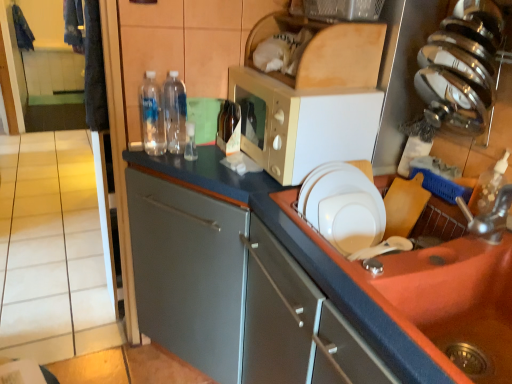
Question: In terms of height, does white glossy plate at upper right look taller or shorter compared to transparent plastic bottle at center, the 2th bottle when ordered from left to right?

Choices:
 (A) tall
 (B) short

Answer: (B)

Question: Based on their sizes in the image, would you say white glossy plate at upper right is bigger or smaller than transparent plastic bottle at center, the 2th bottle viewed from the right?

Choices:
 (A) big
 (B) small

Answer: (B)

Question: Based on their relative distances, which object is farther from the brown glass bottle at center, which is the 1th bottle in right-to-left order?

Choices:
 (A) orange matte sink at lower right
 (B) white glossy plate at upper right
 (C) matte gray cabinet at center
 (D) transparent plastic bottle at center, the 2th bottle when ordered from left to right
 (E) white matte microwave at upper center

Answer: (A)

Question: Estimate the real-world distances between objects in this image. Which object is farther from the beige tile at left?

Choices:
 (A) metallic silver faucet at sink right
 (B) white glossy plate at upper right
 (C) transparent plastic bottle at center, the 2th bottle viewed from the right
 (D) satin silver knife block at upper right
 (E) white matte microwave at upper center

Answer: (A)